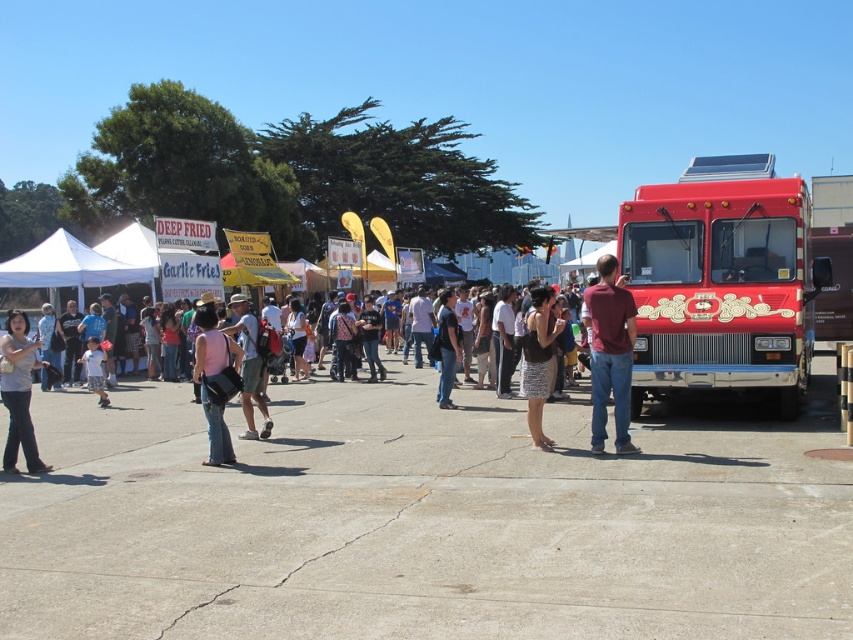
Question: Which object is farther from the camera taking this photo?

Choices:
 (A) shiny red food truck at center
 (B) maroon shirt at center

Answer: (A)

Question: Does maroon shirt at center appear over khaki shorts at center?

Choices:
 (A) yes
 (B) no

Answer: (A)

Question: From the image, what is the correct spatial relationship of maroon shirt at center in relation to khaki shorts at center?

Choices:
 (A) right
 (B) left

Answer: (A)

Question: Can you confirm if shiny red food truck at center is bigger than maroon shirt at center?

Choices:
 (A) yes
 (B) no

Answer: (A)

Question: Which point is closer to the camera?

Choices:
 (A) (26, 320)
 (B) (631, 346)

Answer: (A)

Question: Which object appears closest to the camera in this image?

Choices:
 (A) denim pants at left
 (B) maroon shirt at center
 (C) khaki shorts at center

Answer: (A)